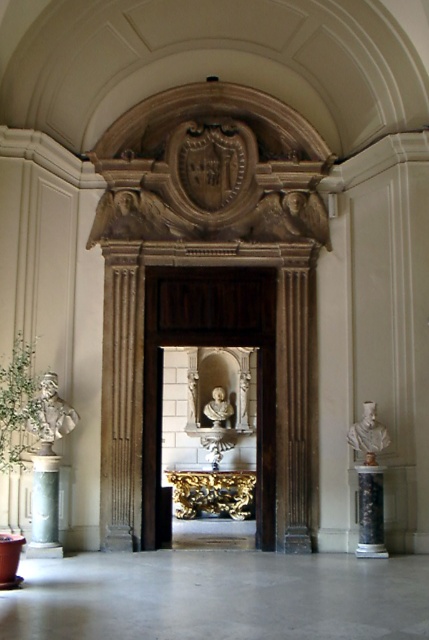
You are standing in the classical interior space and want to determine the relative positions of two points marked in the image. Which point is nearer to you, point (29, 420) or point (372, 465)?

Point (29, 420) is closer to the viewer than point (372, 465).

You are an art conservator examining the classical interior. You need to clean both the white marble bust at right and the white marble bust at center. Which bust should you clean first if you want to start with the one closer to your current position?

The white marble bust at right is in front of the white marble bust at center, so you should clean the white marble bust at right first as it is closer to your current position.